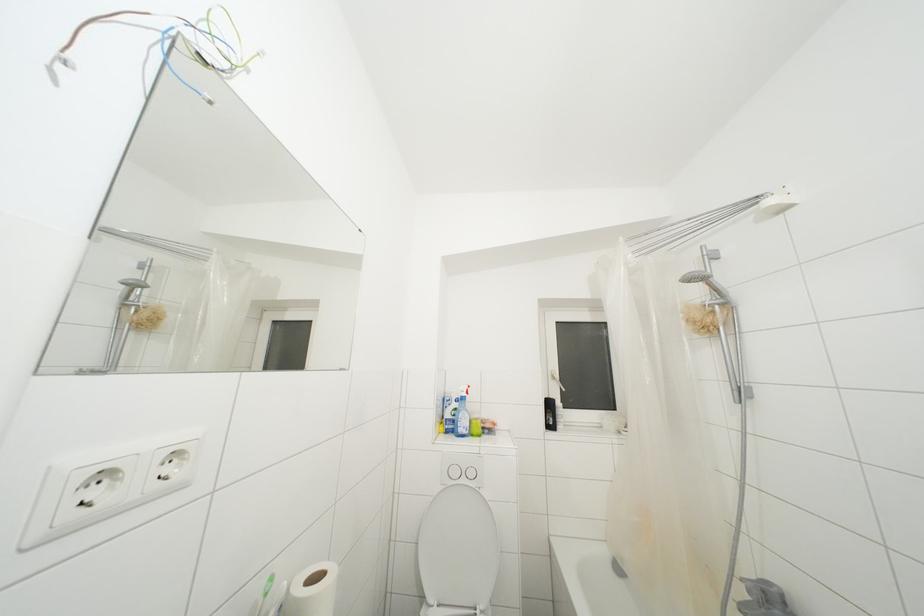
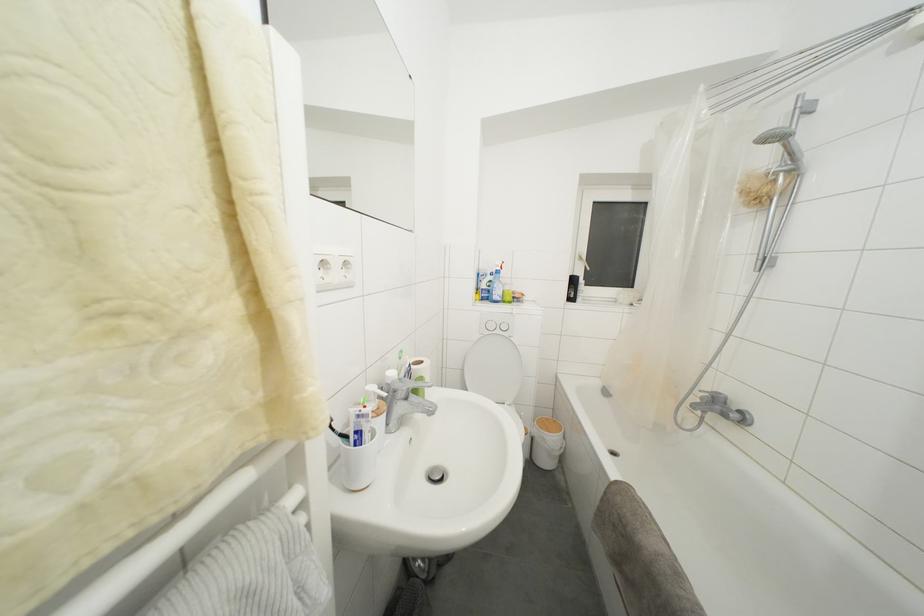
Find the pixel in the second image that matches (455,432) in the first image.

(490, 301)